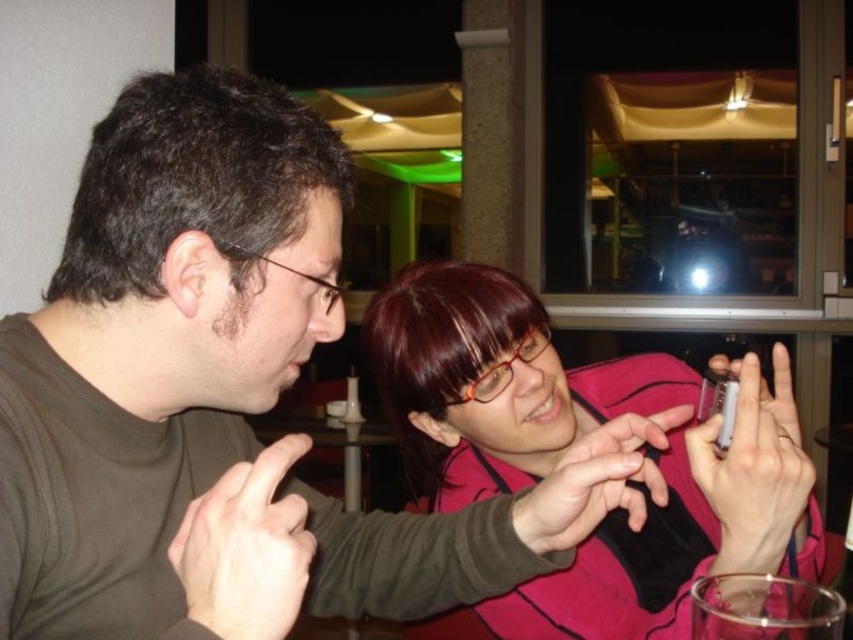
Question: Is pink matte jacket at center to the left of wooden table at center from the viewer's perspective?

Choices:
 (A) no
 (B) yes

Answer: (A)

Question: Can you confirm if pink matte jacket at center is wider than wooden table at center?

Choices:
 (A) yes
 (B) no

Answer: (B)

Question: Which point is farther to the camera?

Choices:
 (A) pink matte jacket at center
 (B) wooden table at center

Answer: (B)

Question: Which point is farther to the camera?

Choices:
 (A) wooden table at center
 (B) pink matte jacket at center

Answer: (A)

Question: In this image, where is pink matte jacket at center located relative to wooden table at center?

Choices:
 (A) below
 (B) above

Answer: (B)

Question: Which point is closer to the camera?

Choices:
 (A) wooden table at center
 (B) pink matte jacket at center

Answer: (B)